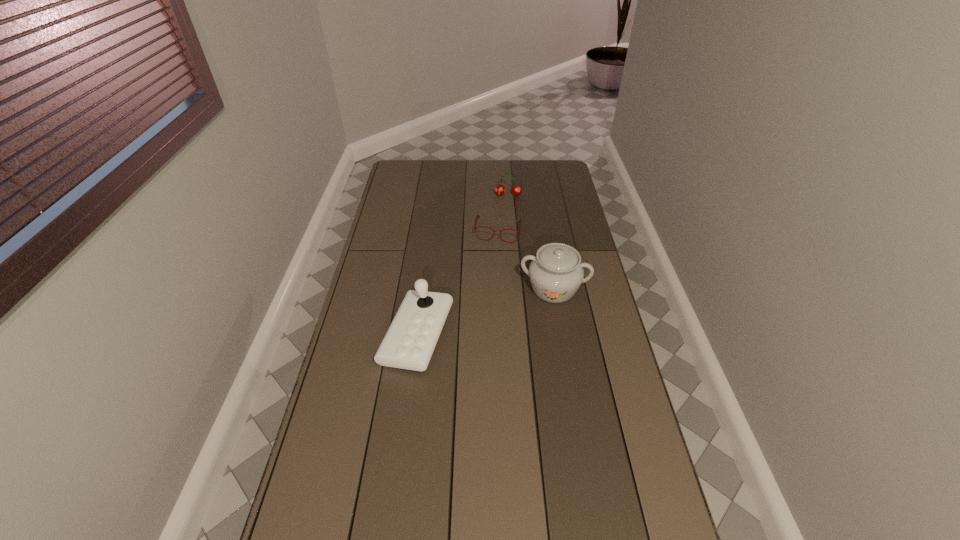
You are a GUI agent. You are given a task and a screenshot of the screen. Output one action in this format:
    pyautogui.click(x=<x>, y=<y>)
    Task: Click on the vacant space located with stems pointing upwards on the farthest object
    The image size is (960, 540).
    Given the screenshot: What is the action you would take?
    pyautogui.click(x=506, y=245)

Locate an element on the screen. This screenshot has width=960, height=540. vacant point located on the face of the third nearest object is located at coordinates 487,294.

Where is `free space located on the face of the third nearest object`? The height and width of the screenshot is (540, 960). free space located on the face of the third nearest object is located at coordinates (486, 298).

This screenshot has width=960, height=540. Find the location of `vacant space located 0.140m on the face of the third nearest object`. vacant space located 0.140m on the face of the third nearest object is located at coordinates (492, 266).

The height and width of the screenshot is (540, 960). I want to click on object at the left edge, so click(x=409, y=343).

The height and width of the screenshot is (540, 960). In order to click on object that is at the right edge in this screenshot , I will do `click(556, 272)`.

I want to click on blank space at the far edge of the desktop, so click(x=510, y=164).

At what (x,y) coordinates should I click in order to perform the action: click on vacant space at the left edge. Please return your answer as a coordinate pair (x, y). The image size is (960, 540). Looking at the image, I should click on (406, 195).

The width and height of the screenshot is (960, 540). Find the location of `vacant space at the right edge`. vacant space at the right edge is located at coordinates (633, 501).

At what (x,y) coordinates should I click in order to perform the action: click on vacant area at the far left corner of the desktop. Please return your answer as a coordinate pair (x, y). Looking at the image, I should click on (405, 180).